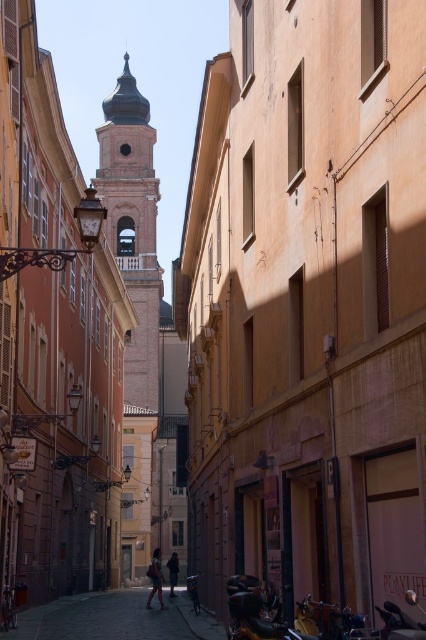
Question: Which object is positioned closest to the dark gray fabric jacket at center?

Choices:
 (A) dark brown leather jacket at center
 (B) smooth beige bell tower at center
 (C) smooth cobblestone alley at center

Answer: (A)

Question: Is smooth cobblestone alley at center bigger than dark gray fabric jacket at center?

Choices:
 (A) yes
 (B) no

Answer: (B)

Question: Is smooth beige bell tower at center in front of smooth cobblestone alley at center?

Choices:
 (A) yes
 (B) no

Answer: (B)

Question: Which of the following is the closest to the observer?

Choices:
 (A) dark brown leather jacket at center
 (B) dark gray fabric jacket at center
 (C) smooth beige bell tower at center

Answer: (B)

Question: Among these objects, which one is nearest to the camera?

Choices:
 (A) dark brown leather jacket at center
 (B) smooth beige bell tower at center
 (C) smooth cobblestone alley at center

Answer: (C)

Question: Where is smooth beige bell tower at center located in relation to dark gray fabric jacket at center in the image?

Choices:
 (A) below
 (B) above

Answer: (B)